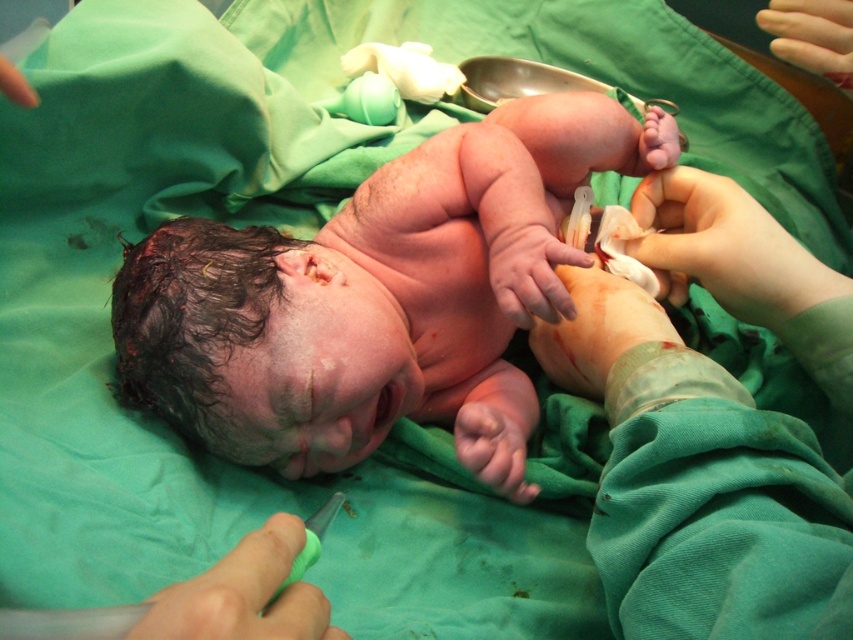
Is pink flesh newborn at center closer to camera compared to smooth skin hand at upper right?

Yes, it is.

Which is in front, point (418, 368) or point (793, 243)?

Point (793, 243) is in front.

This screenshot has height=640, width=853. In order to click on pink flesh newborn at center in this screenshot , I will do `click(367, 300)`.

Who is higher up, smooth skin hand at upper right or green rubber glove at lower center?

smooth skin hand at upper right is higher up.

Does smooth skin hand at upper right come behind green rubber glove at lower center?

Yes, smooth skin hand at upper right is behind green rubber glove at lower center.

Measure the distance between smooth skin hand at upper right and camera.

A distance of 27.30 inches exists between smooth skin hand at upper right and camera.

This screenshot has width=853, height=640. I want to click on smooth skin hand at upper right, so click(724, 248).

Does smooth skin hand at upper right appear over pale skin at upper right?

No.

Where is `smooth skin hand at upper right`? This screenshot has width=853, height=640. smooth skin hand at upper right is located at coordinates (724, 248).